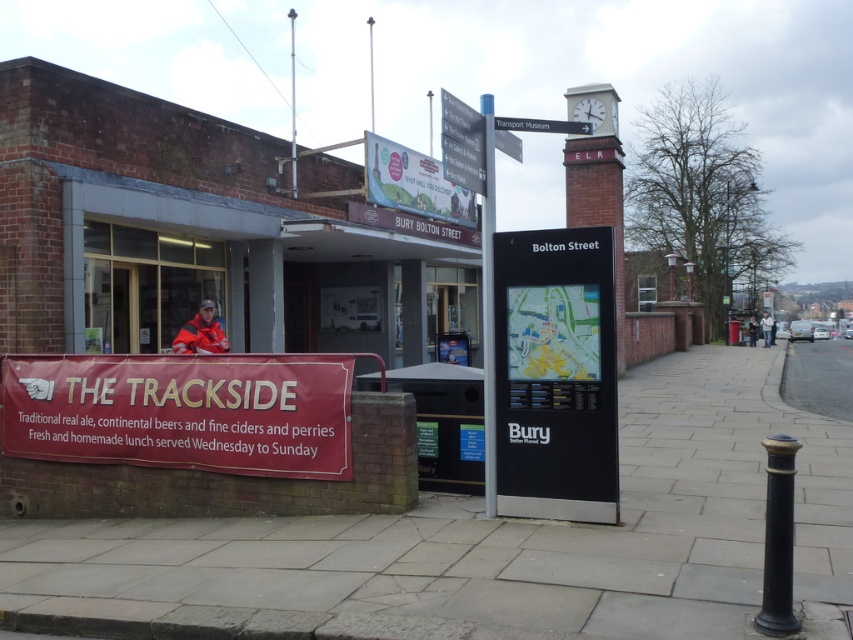
Looking at this image, can you confirm if black plastic map at center is wider than gray concrete pavement at lower right?

In fact, black plastic map at center might be narrower than gray concrete pavement at lower right.

Does black plastic map at center have a lesser height compared to gray concrete pavement at lower right?

No, black plastic map at center is not shorter than gray concrete pavement at lower right.

Is point (549, 403) positioned in front of point (846, 369)?

Yes.

Where is `black plastic map at center`? This screenshot has height=640, width=853. black plastic map at center is located at coordinates (555, 374).

Does matte red banner at lower left have a larger size compared to metallic gray sign at upper center?

No, matte red banner at lower left is not bigger than metallic gray sign at upper center.

Is point (282, 456) in front of point (531, 131)?

No, it is not.

Does point (192, 435) lie behind point (538, 128)?

Yes, it is.

Where is `matte red banner at lower left`? Image resolution: width=853 pixels, height=640 pixels. matte red banner at lower left is located at coordinates (183, 412).

Between red jacket at center and light brown leather jacket at center, which one is positioned lower?

light brown leather jacket at center is below.

Identify the location of red jacket at center. (201, 332).

Locate an element on the screen. The width and height of the screenshot is (853, 640). red jacket at center is located at coordinates (201, 332).